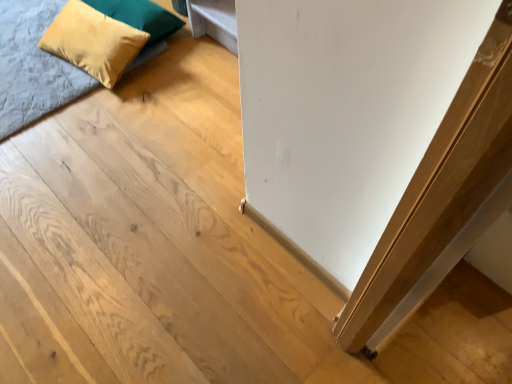
The image size is (512, 384). In order to click on vacant space in front of velvet blue bed at upper left in this screenshot , I will do `click(86, 175)`.